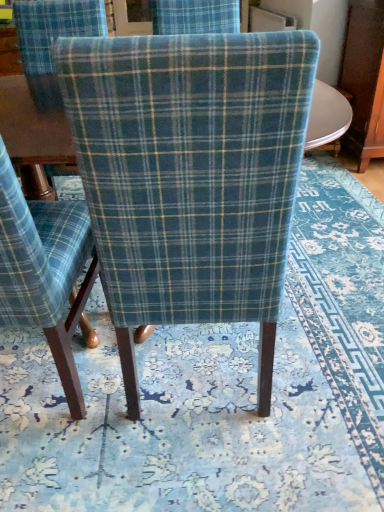
Question: Should I look upward or downward to see blue floral rug at center?

Choices:
 (A) up
 (B) down

Answer: (A)

Question: Is plaid fabric chair at center, acting as the 2th chair starting from the left, located outside blue floral rug at center?

Choices:
 (A) no
 (B) yes

Answer: (B)

Question: From the image's perspective, is plaid fabric chair at center, the first chair from the right, under blue floral rug at center?

Choices:
 (A) yes
 (B) no

Answer: (A)

Question: Is plaid fabric chair at center, the first chair from the right, far from blue floral rug at center?

Choices:
 (A) no
 (B) yes

Answer: (A)

Question: From a real-world perspective, does plaid fabric chair at center, acting as the 2th chair starting from the left, sit lower than blue floral rug at center?

Choices:
 (A) yes
 (B) no

Answer: (B)

Question: Is plaid fabric chair at center, the first chair from the right, turned away from blue floral rug at center?

Choices:
 (A) no
 (B) yes

Answer: (A)

Question: Does plaid fabric chair at center, acting as the 2th chair starting from the left, have a smaller size compared to blue floral rug at center?

Choices:
 (A) yes
 (B) no

Answer: (B)

Question: Considering the relative sizes of blue floral rug at center and blue plaid fabric chair at center, marked as the 1th chair in a left-to-right arrangement, in the image provided, is blue floral rug at center taller than blue plaid fabric chair at center, marked as the 1th chair in a left-to-right arrangement,?

Choices:
 (A) no
 (B) yes

Answer: (A)

Question: Is blue floral rug at center in front of blue plaid fabric chair at center, marked as the 1th chair in a left-to-right arrangement?

Choices:
 (A) no
 (B) yes

Answer: (A)

Question: Is blue floral rug at center placed right next to blue plaid fabric chair at center, marked as the 1th chair in a left-to-right arrangement?

Choices:
 (A) no
 (B) yes

Answer: (A)

Question: Is blue floral rug at center not inside blue plaid fabric chair at center, the second chair when ordered from right to left?

Choices:
 (A) no
 (B) yes

Answer: (B)

Question: Considering the relative sizes of blue floral rug at center and blue plaid fabric chair at center, marked as the 1th chair in a left-to-right arrangement, in the image provided, is blue floral rug at center wider than blue plaid fabric chair at center, marked as the 1th chair in a left-to-right arrangement,?

Choices:
 (A) yes
 (B) no

Answer: (A)

Question: From a real-world perspective, is blue floral rug at center physically above blue plaid fabric chair at center, the second chair when ordered from right to left?

Choices:
 (A) yes
 (B) no

Answer: (B)

Question: Could blue floral rug at center be considered to be inside blue plaid fabric chair at center, marked as the 1th chair in a left-to-right arrangement?

Choices:
 (A) yes
 (B) no

Answer: (B)